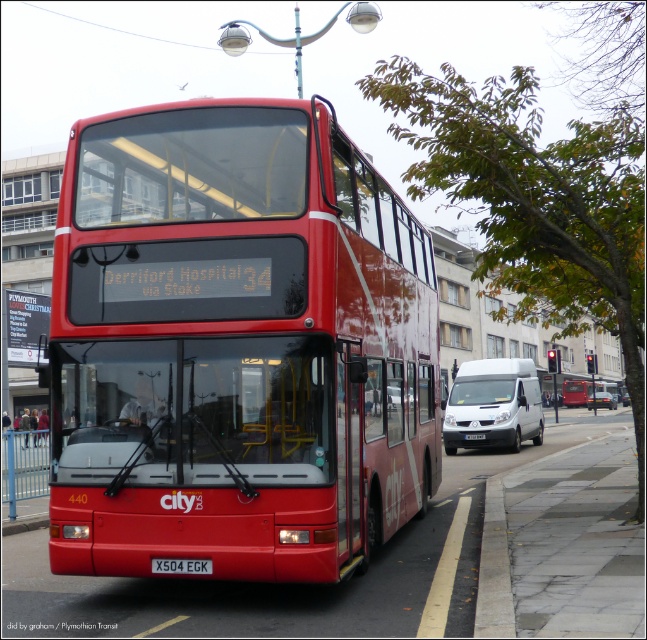
Looking at this image, between white matte van at center-right and white plastic license plate at center, which one appears on the left side from the viewer's perspective?

white plastic license plate at center is more to the left.

Is white matte van at center-right shorter than white plastic license plate at center?

No.

Between point (487, 404) and point (466, 433), which one is positioned behind?

Positioned behind is point (487, 404).

At what (x,y) coordinates should I click in order to perform the action: click on white matte van at center-right. Please return your answer as a coordinate pair (x, y). Looking at the image, I should click on (494, 404).

Can you confirm if white matte van at center-right is positioned to the right of black plastic license plate at center?

Yes, white matte van at center-right is to the right of black plastic license plate at center.

Is point (468, 429) farther from viewer compared to point (210, 560)?

Yes.

At what (x,y) coordinates should I click in order to perform the action: click on white matte van at center-right. Please return your answer as a coordinate pair (x, y). Looking at the image, I should click on (494, 404).

Does matte white van at center have a larger size compared to white plastic license plate at center?

Indeed, matte white van at center has a larger size compared to white plastic license plate at center.

Who is taller, matte white van at center or white plastic license plate at center?

With more height is matte white van at center.

Who is more distant from viewer, (595, 404) or (483, 438)?

Positioned behind is point (595, 404).

Find the location of a particular element. Image resolution: width=647 pixels, height=640 pixels. matte white van at center is located at coordinates (600, 401).